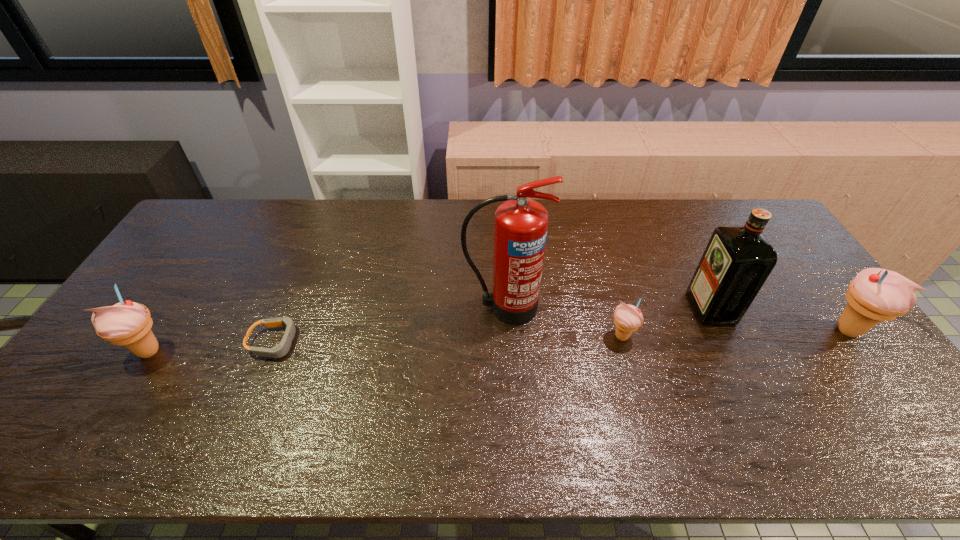
This screenshot has height=540, width=960. I want to click on goggles, so click(x=280, y=350).

You are a GUI agent. You are given a task and a screenshot of the screen. Output one action in this format:
    pyautogui.click(x=<x>, y=<y>)
    Task: Click on the vacant point located on the front of the third shortest object
    This screenshot has height=540, width=960.
    Given the screenshot: What is the action you would take?
    pyautogui.click(x=108, y=416)

Find the location of a particular element. This screenshot has height=540, width=960. vacant area situated on the front of the third object from right to left is located at coordinates (630, 367).

The height and width of the screenshot is (540, 960). Identify the location of vacant space situated 0.220m on the back of the rightmost object. (797, 260).

The width and height of the screenshot is (960, 540). What are the coordinates of `vacant space positioned on the front label of the second tallest object` in the screenshot? It's located at (638, 308).

What are the coordinates of `vacant space located 0.100m on the front label of the second tallest object` in the screenshot? It's located at click(x=660, y=308).

Where is `free space located on the front label of the second tallest object`? The image size is (960, 540). free space located on the front label of the second tallest object is located at coordinates (564, 308).

Find the location of a particular element. The image size is (960, 540). free region located 0.180m on the surface of the fire extinguisher is located at coordinates (508, 381).

Image resolution: width=960 pixels, height=540 pixels. Find the location of `vacant space located 0.170m on the front and back of the shortest object`. vacant space located 0.170m on the front and back of the shortest object is located at coordinates (362, 342).

You are a GUI agent. You are given a task and a screenshot of the screen. Output one action in this format:
    pyautogui.click(x=<x>, y=<y>)
    Task: Click on the object at the left edge
    
    Given the screenshot: What is the action you would take?
    pyautogui.click(x=127, y=323)